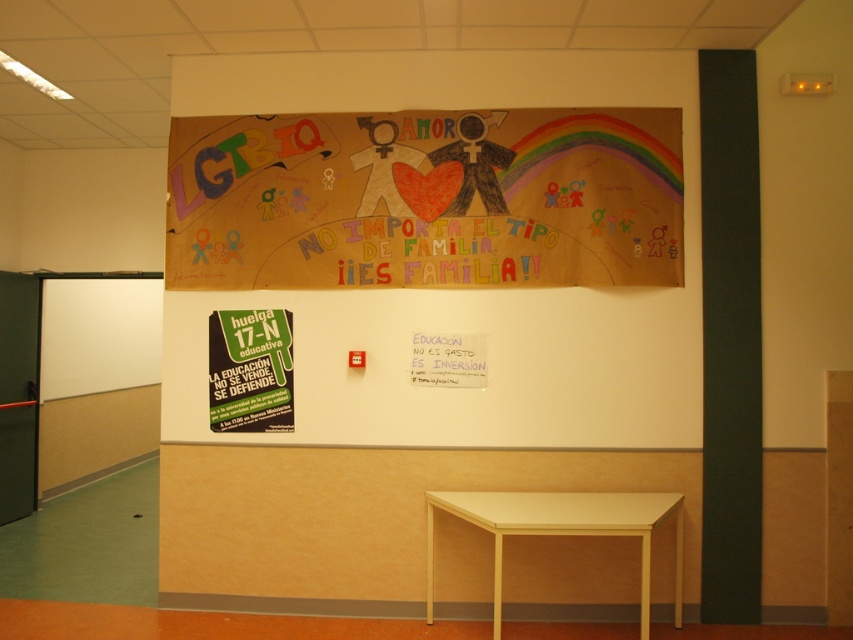
Is cardboard banner at upper center to the left of white paper at upper center from the viewer's perspective?

Indeed, cardboard banner at upper center is positioned on the left side of white paper at upper center.

Does cardboard banner at upper center have a greater width compared to white paper at upper center?

Correct, the width of cardboard banner at upper center exceeds that of white paper at upper center.

What do you see at coordinates (463, 289) in the screenshot?
I see `cardboard banner at upper center` at bounding box center [463, 289].

Find the location of a particular element. cardboard banner at upper center is located at coordinates (463, 289).

Who is lower down, cardboard banner at upper center or white matte table at lower center?

white matte table at lower center

Which is in front, point (502, 417) or point (494, 525)?

Point (494, 525)

Locate an element on the screen. cardboard banner at upper center is located at coordinates (463, 289).

At what (x,y) coordinates should I click in order to perform the action: click on cardboard banner at upper center. Please return your answer as a coordinate pair (x, y). This screenshot has height=640, width=853. Looking at the image, I should click on (463, 289).

Is point (682, 522) closer to viewer compared to point (456, 349)?

That is True.

Does point (636, 500) lie in front of point (479, 344)?

Yes, it is in front of point (479, 344).

Find the location of a particular element. white matte table at lower center is located at coordinates (561, 529).